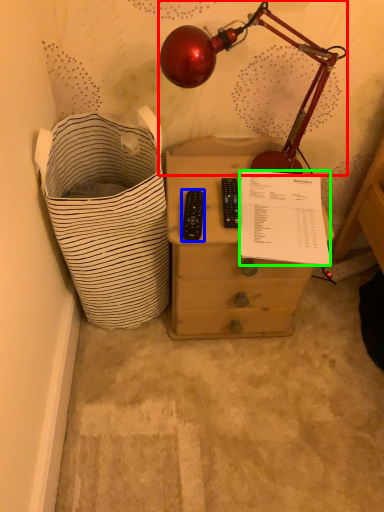
Question: Estimate the real-world distances between objects in this image. Which object is farther from lamp (highlighted by a red box), control (highlighted by a blue box) or writing (highlighted by a green box)?

Choices:
 (A) control
 (B) writing

Answer: (A)